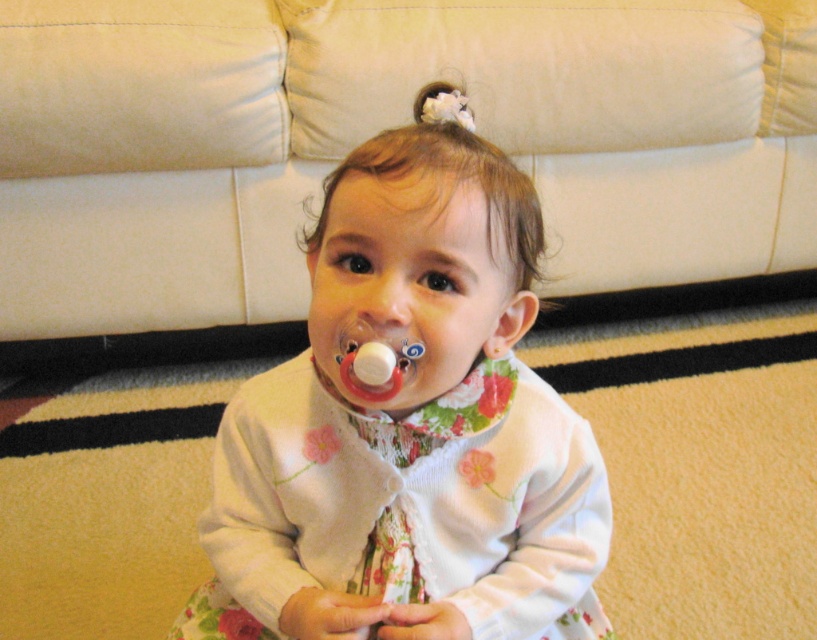
Can you confirm if white leather couch at upper center is positioned above rubber pacifier at center?

Yes.

The width and height of the screenshot is (817, 640). I want to click on white leather couch at upper center, so click(373, 132).

Does point (260, 145) come farther from viewer compared to point (369, 365)?

Yes, it is behind point (369, 365).

Where is `white leather couch at upper center`? white leather couch at upper center is located at coordinates (373, 132).

Which is below, white leather couch at upper center or smooth white pacifier at center?

smooth white pacifier at center is lower down.

Which is in front, point (681, 154) or point (396, 292)?

Positioned in front is point (396, 292).

I want to click on white leather couch at upper center, so click(x=373, y=132).

Does white floral dress at center have a greater height compared to smooth white pacifier at center?

Yes, white floral dress at center is taller than smooth white pacifier at center.

Looking at this image, can you confirm if white floral dress at center is shorter than smooth white pacifier at center?

Result: In fact, white floral dress at center may be taller than smooth white pacifier at center.

The width and height of the screenshot is (817, 640). Identify the location of white floral dress at center. (409, 428).

The width and height of the screenshot is (817, 640). Find the location of `white floral dress at center`. white floral dress at center is located at coordinates (409, 428).